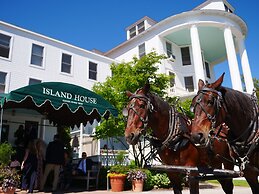
At what (x,y) coordinates should I click in order to perform the action: click on pot. Please return your answer as a coordinate pair (x, y). This screenshot has width=259, height=194. Looking at the image, I should click on (135, 186), (113, 182).